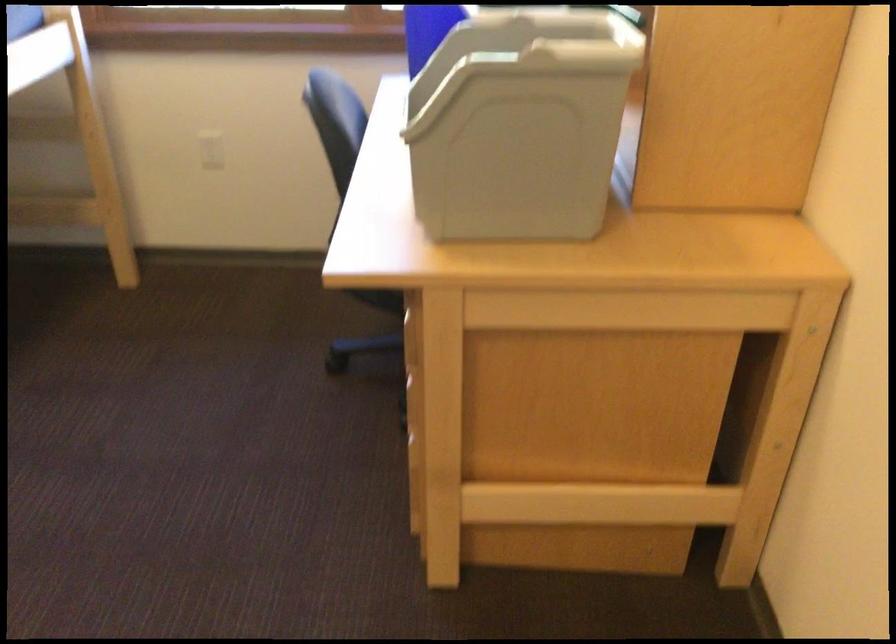
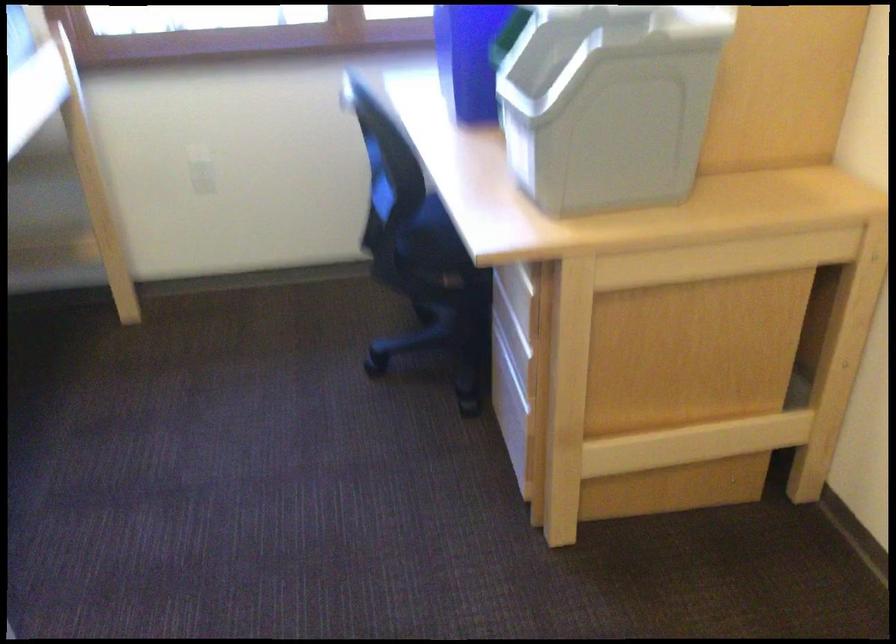
Question: How did the camera likely rotate?

Choices:
 (A) Left
 (B) Right
 (C) Up
 (D) Down

Answer: (B)